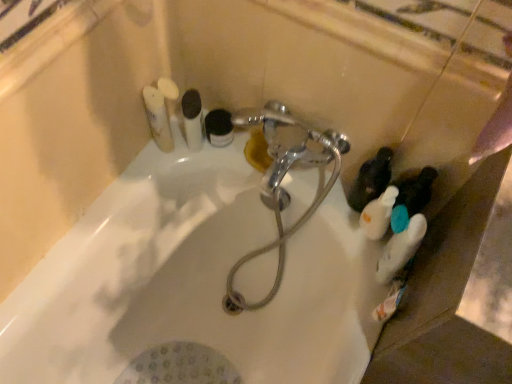
Question: From a real-world perspective, is white matte toothbrushes at upper left, which is the second toiletry from left to right, on black matte jar at upper center, marked as the 3th toiletry in a right-to-left arrangement?

Choices:
 (A) no
 (B) yes

Answer: (B)

Question: Can you confirm if white matte toothbrushes at upper left, arranged as the 5th toiletry when viewed from the right, is smaller than black matte jar at upper center, marked as the 3th toiletry in a right-to-left arrangement?

Choices:
 (A) yes
 (B) no

Answer: (B)

Question: Considering the relative sizes of white matte toothbrushes at upper left, which is the second toiletry from left to right, and black matte jar at upper center, marked as the 3th toiletry in a right-to-left arrangement, in the image provided, is white matte toothbrushes at upper left, which is the second toiletry from left to right, taller than black matte jar at upper center, marked as the 3th toiletry in a right-to-left arrangement,?

Choices:
 (A) yes
 (B) no

Answer: (A)

Question: Considering the relative positions of white matte toothbrushes at upper left, arranged as the 5th toiletry when viewed from the right, and black matte jar at upper center, the 4th toiletry from the left, in the image provided, is white matte toothbrushes at upper left, arranged as the 5th toiletry when viewed from the right, to the right of black matte jar at upper center, the 4th toiletry from the left, from the viewer's perspective?

Choices:
 (A) yes
 (B) no

Answer: (B)

Question: Is white matte toothbrushes at upper left, arranged as the 5th toiletry when viewed from the right, to the left of black matte jar at upper center, marked as the 3th toiletry in a right-to-left arrangement, from the viewer's perspective?

Choices:
 (A) no
 (B) yes

Answer: (B)

Question: Can you confirm if white matte toothbrushes at upper left, arranged as the 5th toiletry when viewed from the right, is bigger than black matte jar at upper center, the 4th toiletry from the left?

Choices:
 (A) no
 (B) yes

Answer: (B)

Question: Is chrome metallic faucet at center in contact with white matte toothpaste tube at upper left, which appears as the 6th toiletry when viewed from the right?

Choices:
 (A) yes
 (B) no

Answer: (B)

Question: Is chrome metallic faucet at center positioned behind white matte toothpaste tube at upper left, which appears as the 6th toiletry when viewed from the right?

Choices:
 (A) no
 (B) yes

Answer: (A)

Question: Can you confirm if chrome metallic faucet at center is smaller than white matte toothpaste tube at upper left, arranged as the first toiletry when viewed from the left?

Choices:
 (A) yes
 (B) no

Answer: (B)

Question: Is the depth of chrome metallic faucet at center less than that of white matte toothpaste tube at upper left, arranged as the first toiletry when viewed from the left?

Choices:
 (A) yes
 (B) no

Answer: (A)

Question: Is chrome metallic faucet at center facing away from white matte toothpaste tube at upper left, which appears as the 6th toiletry when viewed from the right?

Choices:
 (A) no
 (B) yes

Answer: (A)

Question: Considering the relative sizes of chrome metallic faucet at center and white matte toothpaste tube at upper left, arranged as the first toiletry when viewed from the left, in the image provided, is chrome metallic faucet at center shorter than white matte toothpaste tube at upper left, arranged as the first toiletry when viewed from the left,?

Choices:
 (A) yes
 (B) no

Answer: (B)

Question: Is white matte bottle at lower right closer to the viewer compared to chrome metallic faucet at center?

Choices:
 (A) yes
 (B) no

Answer: (B)